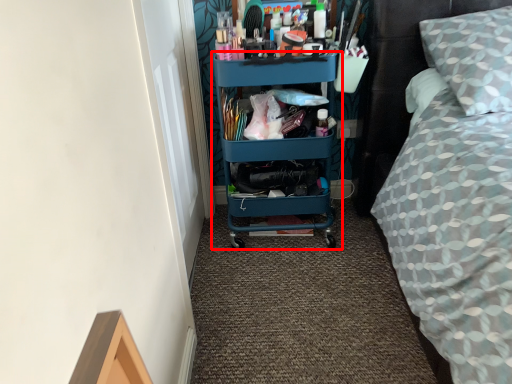
Question: From the image's perspective, where is shelf (annotated by the red box) located in relation to bed in the image?

Choices:
 (A) above
 (B) below

Answer: (B)